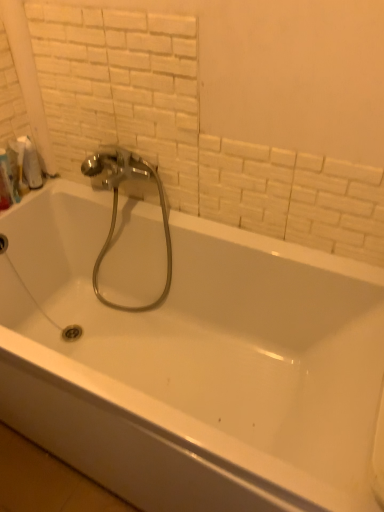
Question: Considering the relative positions of polished chrome faucet at upper center and white matte toilet paper at upper left in the image provided, is polished chrome faucet at upper center to the left or to the right of white matte toilet paper at upper left?

Choices:
 (A) left
 (B) right

Answer: (B)

Question: Would you say polished chrome faucet at upper center is inside or outside white matte toilet paper at upper left?

Choices:
 (A) outside
 (B) inside

Answer: (A)

Question: Based on their relative distances, which object is farther from the white glossy bathtub at center?

Choices:
 (A) polished chrome faucet at upper center
 (B) white plastic bottle at upper left
 (C) white matte toilet paper at upper left

Answer: (C)

Question: Estimate the real-world distances between objects in this image. Which object is closer to the white matte toilet paper at upper left?

Choices:
 (A) white plastic bottle at upper left
 (B) white glossy bathtub at center
 (C) polished chrome faucet at upper center

Answer: (A)